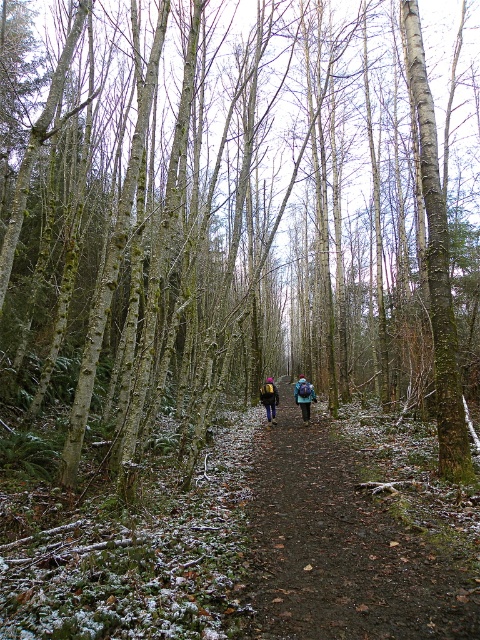
Does point (343, 518) come farther from viewer compared to point (303, 392)?

That is False.

Image resolution: width=480 pixels, height=640 pixels. What do you see at coordinates (339, 548) in the screenshot?
I see `brown dirt path at center` at bounding box center [339, 548].

Is point (278, 566) farther from camera compared to point (297, 403)?

No, it is in front of (297, 403).

Find the location of a particular element. This screenshot has height=640, width=480. brown dirt path at center is located at coordinates (339, 548).

In the scene shown: Between blue fabric backpack at center and blue fabric jacket at center, which one is positioned lower?

blue fabric backpack at center is below.

Can you confirm if blue fabric backpack at center is positioned to the left of blue fabric jacket at center?

Incorrect, blue fabric backpack at center is not on the left side of blue fabric jacket at center.

Does point (295, 394) lie behind point (267, 396)?

That is True.

This screenshot has width=480, height=640. Find the location of `blue fabric backpack at center`. blue fabric backpack at center is located at coordinates (303, 396).

Which of these two, brown dirt path at center or matte blue jacket at center, stands taller?

With more height is matte blue jacket at center.

This screenshot has width=480, height=640. I want to click on brown dirt path at center, so click(339, 548).

This screenshot has width=480, height=640. I want to click on brown dirt path at center, so click(339, 548).